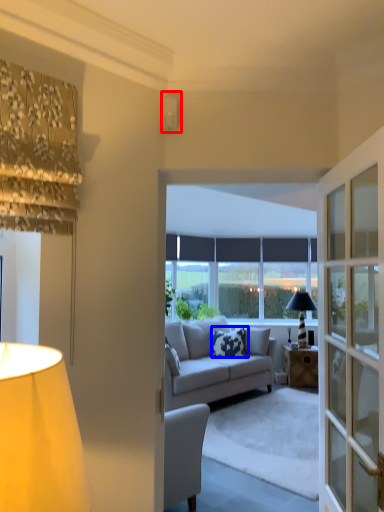
Question: Which point is further to the camera, lamp (highlighted by a red box) or pillow (highlighted by a blue box)?

Choices:
 (A) lamp
 (B) pillow

Answer: (B)